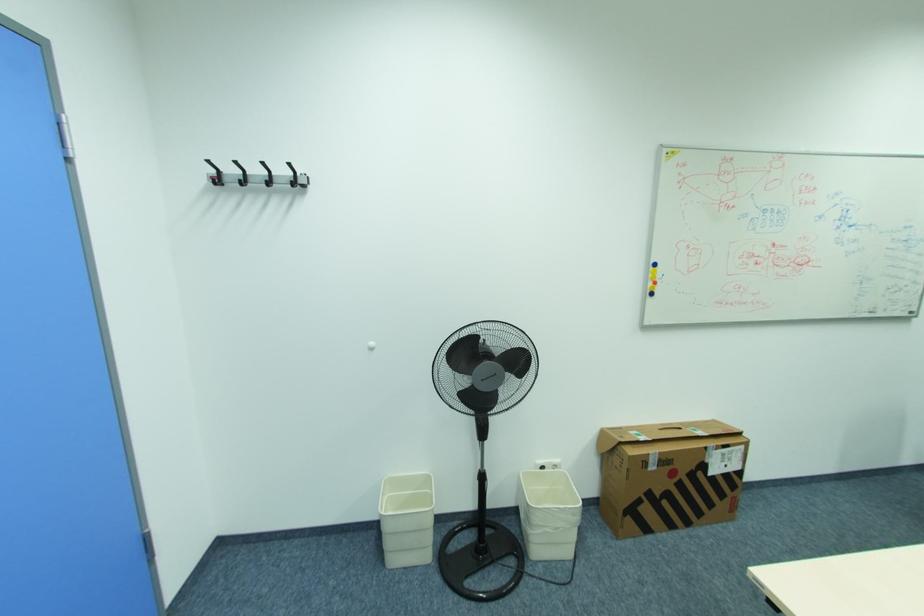
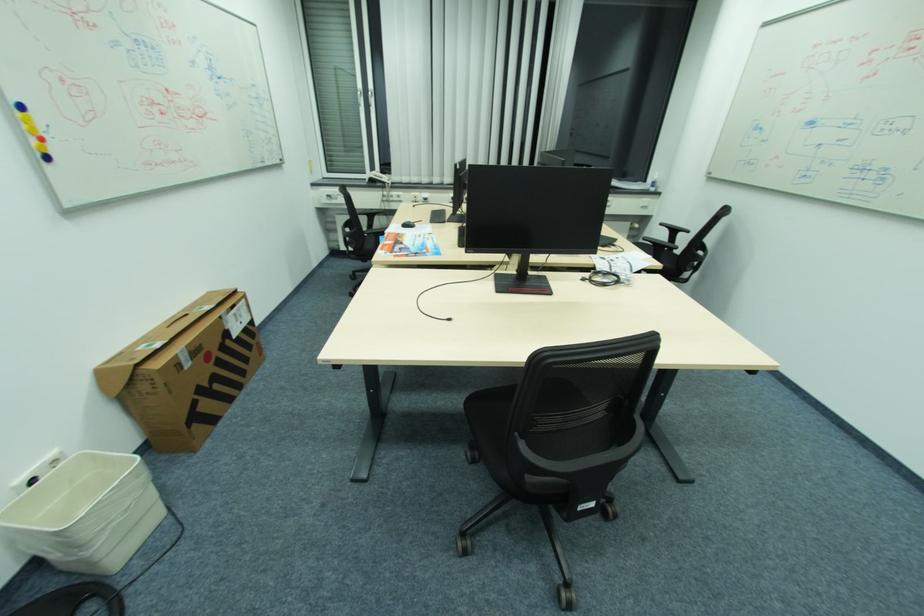
The point at (578,515) is marked in the first image. Where is the corresponding point in the second image?

(143, 476)